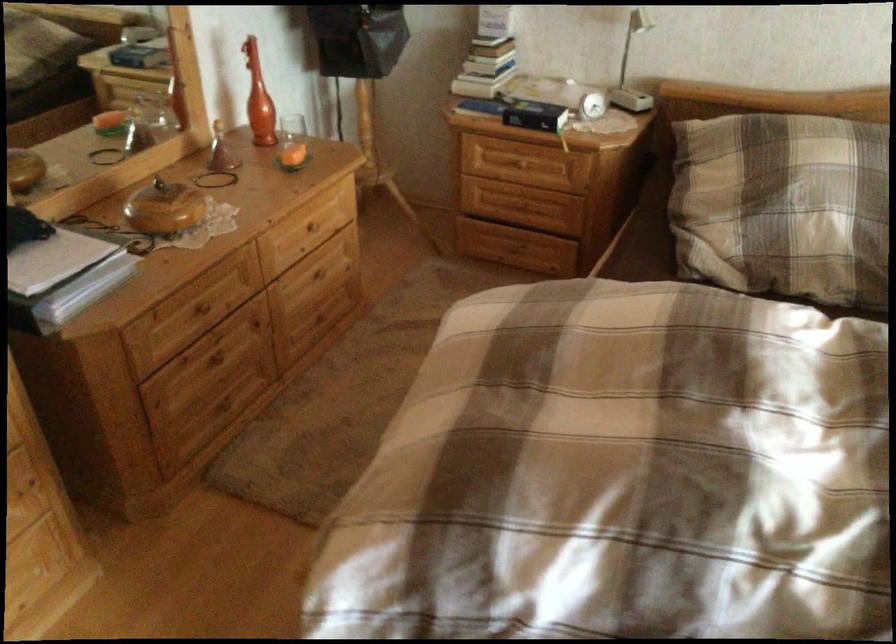
Where would you lift the white desk lamp? Please return your answer as a coordinate pair (x, y).

(632, 67)